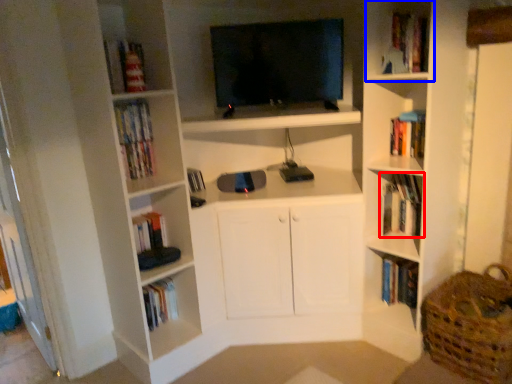
Question: Which object is further to the camera taking this photo, book (highlighted by a red box) or cabinet (highlighted by a blue box)?

Choices:
 (A) book
 (B) cabinet

Answer: (A)